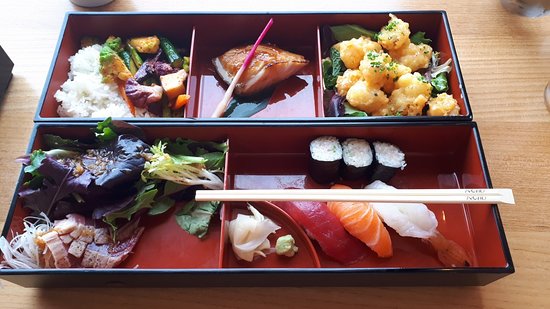
Where is `rectangular compartment`? The height and width of the screenshot is (309, 550). rectangular compartment is located at coordinates (167, 254).